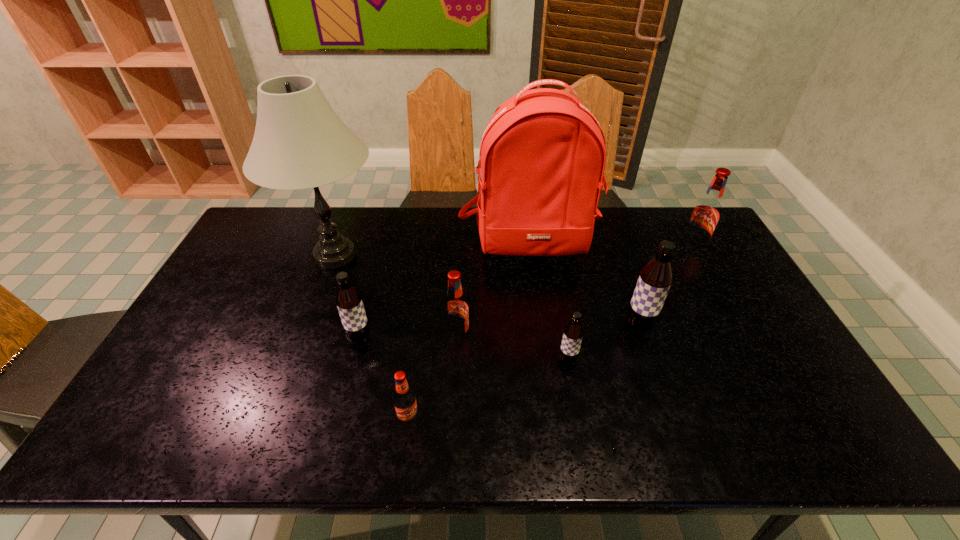
Locate an element on the screen. vacant space at the right edge is located at coordinates (734, 312).

In order to click on free space at the far left corner of the desktop in this screenshot , I will do `click(278, 240)`.

Locate an element on the screen. This screenshot has height=540, width=960. blank space at the near right corner of the desktop is located at coordinates (778, 420).

Locate an element on the screen. This screenshot has height=540, width=960. free spot between the third root beer from right to left and the nearest root beer is located at coordinates (488, 390).

At what (x,y) coordinates should I click in order to perform the action: click on empty space between the fifth farthest root beer and the farthest root beer. Please return your answer as a coordinate pair (x, y). The height and width of the screenshot is (540, 960). Looking at the image, I should click on (630, 304).

The width and height of the screenshot is (960, 540). In order to click on free spot between the fourth root beer from left to right and the backpack in this screenshot , I will do `click(549, 303)`.

Find the location of a particular element. This screenshot has width=960, height=540. free space between the biggest brown root beer and the backpack is located at coordinates tap(585, 286).

Find the location of a particular element. This screenshot has height=540, width=960. vacant space that is in between the second red root beer from right to left and the sixth object from right to left is located at coordinates (433, 379).

You are a GUI agent. You are given a task and a screenshot of the screen. Output one action in this format:
    pyautogui.click(x=<x>, y=<y>)
    Task: Click on the vacant region between the second red root beer from right to left and the red backpack
    
    Given the screenshot: What is the action you would take?
    pyautogui.click(x=494, y=292)

Where is `free spot between the nearest brown root beer and the biggest brown root beer`? This screenshot has height=540, width=960. free spot between the nearest brown root beer and the biggest brown root beer is located at coordinates (603, 343).